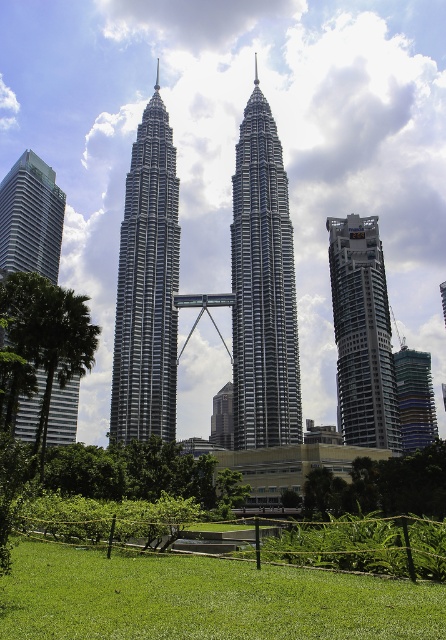
Question: Which point appears farthest from the camera in this image?

Choices:
 (A) (156, 138)
 (B) (11, 228)
 (C) (284, 200)

Answer: (A)

Question: Which object is farther from the camera taking this photo?

Choices:
 (A) green leafy tree at lower center
 (B) green leafy tree at left

Answer: (A)

Question: Is silver metallic skyscraper at center thinner than silver metallic twin towers at center?

Choices:
 (A) no
 (B) yes

Answer: (B)

Question: Is green glass building at lower right positioned behind glassy reflective building at center?

Choices:
 (A) yes
 (B) no

Answer: (A)

Question: Is green grass at lower center bigger than green glass building at lower right?

Choices:
 (A) yes
 (B) no

Answer: (A)

Question: Estimate the real-world distances between objects in this image. Which object is farther from the green leafy tree at left?

Choices:
 (A) green glass building at lower right
 (B) silver metallic skyscraper at right

Answer: (A)